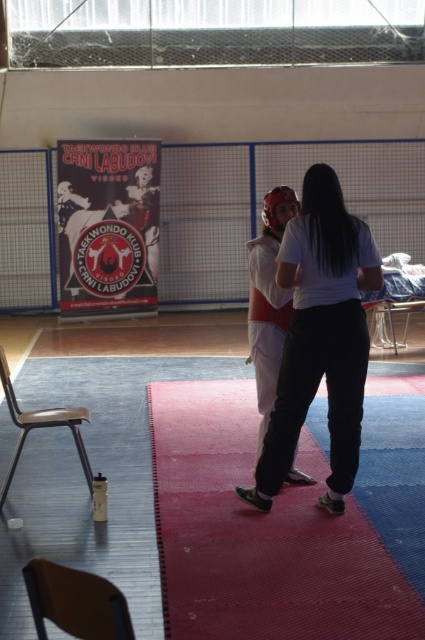
Based on the photo, you are standing in the gymnasium and want to place a small mat between the two points, point (172, 474) and point (362, 248). Which point should the mat be closer to in order to be closer to the viewer?

The mat should be closer to point (172, 474) because it is closer to the viewer than point (362, 248).

You are a martial artist preparing to practice a high kick. You need to ensure there is enough space between you and the wall behind the rubberized red mat at center. The wall is 12 feet away from the mat. Can you safely perform the kick without hitting the wall?

The rubberized red mat at center is 10.59 feet away from the camera. Since the wall is 12 feet away from the mat, the total distance from you to the wall would be 10.59 feet plus 12 feet, totaling 22.59 feet. This should provide ample space to safely perform the high kick without hitting the wall.